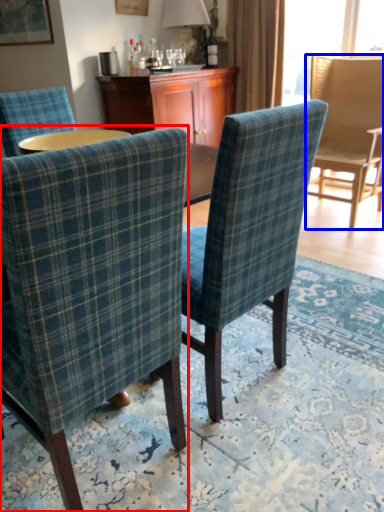
Question: Among these objects, which one is farthest to the camera, chair (highlighted by a red box) or chair (highlighted by a blue box)?

Choices:
 (A) chair
 (B) chair

Answer: (B)